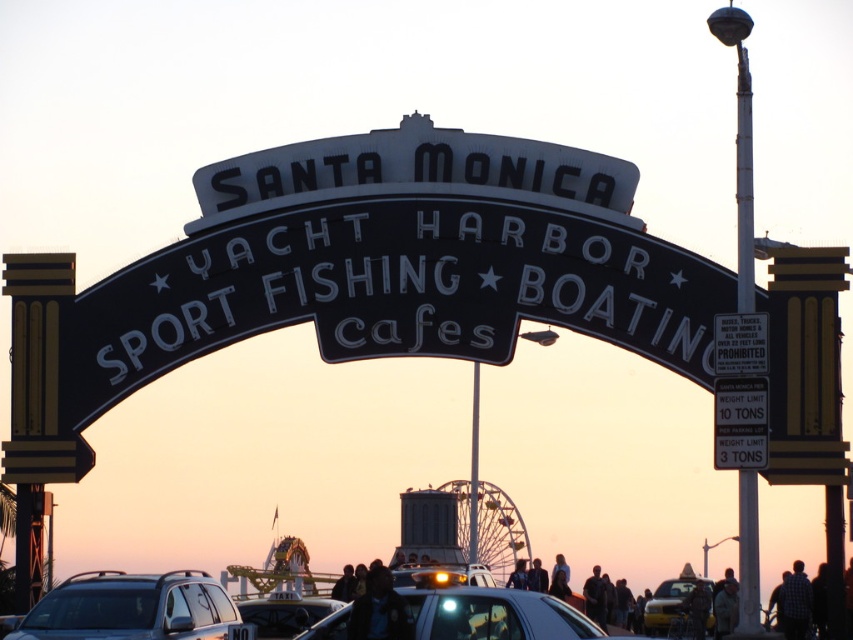
Question: Does shiny silver car at center appear under matte black taxi at center?

Choices:
 (A) yes
 (B) no

Answer: (B)

Question: Does shiny silver car at center appear under yellow matte taxi cab at center?

Choices:
 (A) yes
 (B) no

Answer: (B)

Question: Which object appears closest to the camera in this image?

Choices:
 (A) shiny silver car at center
 (B) yellow matte taxi cab at center
 (C) matte black taxi at center

Answer: (A)

Question: Does silver metallic suv at center lie in front of yellow matte taxi cab at center?

Choices:
 (A) no
 (B) yes

Answer: (B)

Question: Which point is closer to the camera?

Choices:
 (A) (665, 609)
 (B) (432, 625)
 (C) (285, 618)
 (D) (62, 627)

Answer: (B)

Question: Estimate the real-world distances between objects in this image. Which object is closer to the matte black taxi at center?

Choices:
 (A) yellow matte taxi cab at center
 (B) shiny silver car at center
 (C) silver metallic suv at center

Answer: (C)